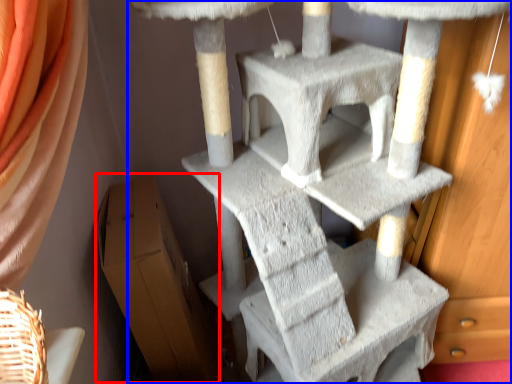
Question: Which object is closer to the camera taking this photo, cardboard box (highlighted by a red box) or furniture (highlighted by a blue box)?

Choices:
 (A) cardboard box
 (B) furniture

Answer: (B)